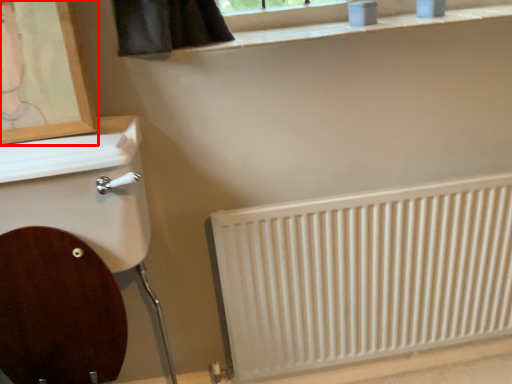
Question: From the image's perspective, what is the correct spatial positioning of picture frame (annotated by the red box) in reference to radiator?

Choices:
 (A) above
 (B) below

Answer: (A)